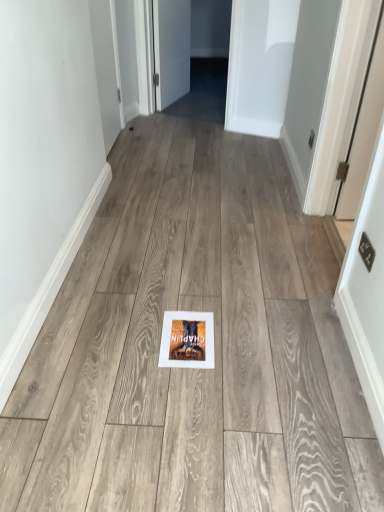
Measure the distance between point (175, 357) and camera.

Point (175, 357) and camera are 1.59 meters apart from each other.

This screenshot has height=512, width=384. Describe the element at coordinates (187, 340) in the screenshot. I see `matte gold postcard at center` at that location.

You are a GUI agent. You are given a task and a screenshot of the screen. Output one action in this format:
    pyautogui.click(x=<x>, y=<y>)
    Task: Click on the matte gold postcard at center
    
    Given the screenshot: What is the action you would take?
    pyautogui.click(x=187, y=340)

Identify the location of matte gold postcard at center. (187, 340).